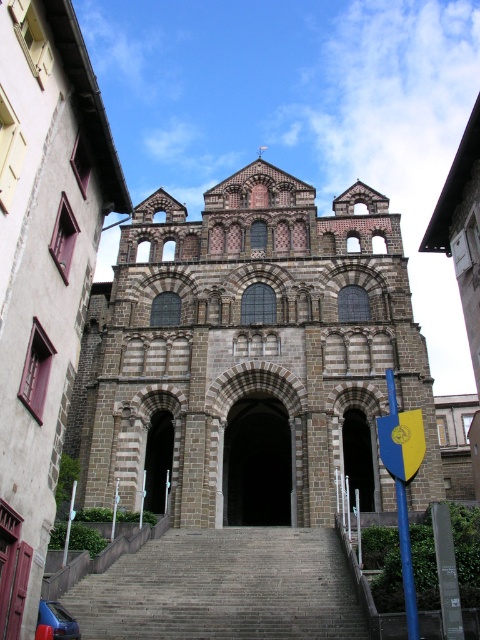
Question: In this image, where is gray stone church at center located relative to dark stone archway at center?

Choices:
 (A) below
 (B) above

Answer: (B)

Question: Considering the real-world distances, which object is closest to the brown stone archway at center?

Choices:
 (A) brown stone arch at center
 (B) gray stone church at center
 (C) dark stone archway at center

Answer: (C)

Question: Is brown stone arch at center smaller than brown stone archway at center?

Choices:
 (A) no
 (B) yes

Answer: (A)

Question: Does brown stone church at center appear over gray stone stairs at center?

Choices:
 (A) yes
 (B) no

Answer: (A)

Question: Estimate the real-world distances between objects in this image. Which object is closer to the gray stone church at center?

Choices:
 (A) gray stone stairs at center
 (B) dark stone archway at center
 (C) brown stone church at center
 (D) brown stone archway at center

Answer: (B)

Question: Which point is closer to the camera?

Choices:
 (A) dark stone archway at center
 (B) brown stone archway at center
 (C) gray stone church at center
 (D) brown stone church at center

Answer: (D)